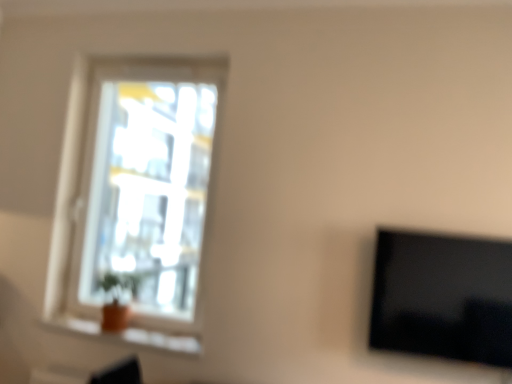
Where is `free point above transparent glass window at upper left (from a real-world perspective)`? free point above transparent glass window at upper left (from a real-world perspective) is located at coordinates (163, 60).